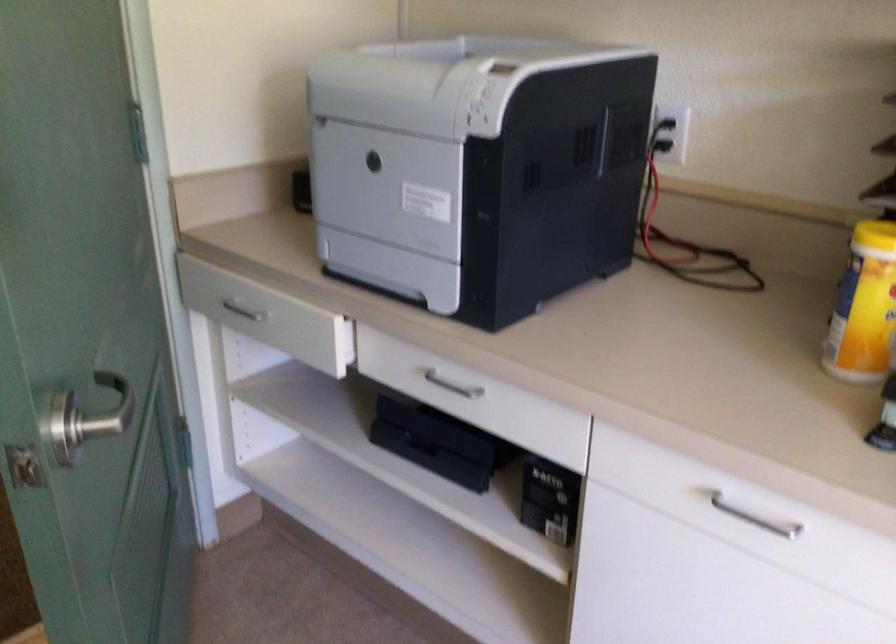
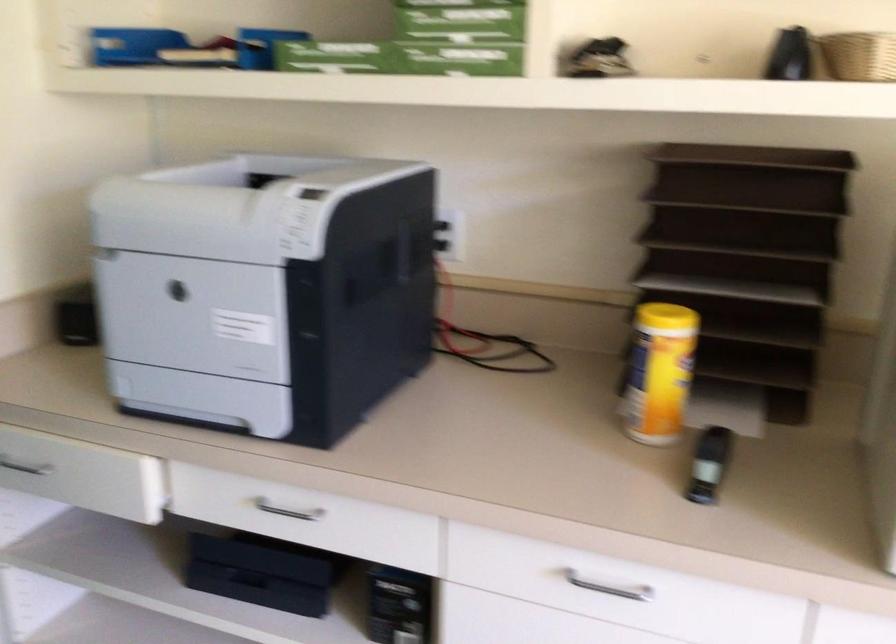
Question: What movement of the cameraman would produce the second image?

Choices:
 (A) Left
 (B) Right
 (C) Forward
 (D) Backward

Answer: (A)